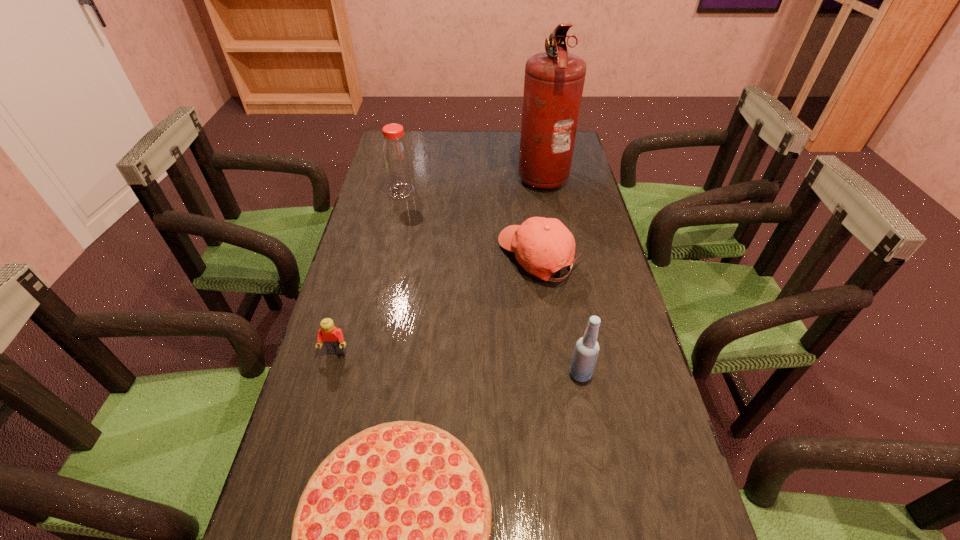
Find the location of a particular element. vacant space situated 0.330m at the front of the tallest object where the nozzle is aimed is located at coordinates (426, 175).

What are the coordinates of `free space located 0.140m at the front of the tallest object where the nozzle is aimed` in the screenshot? It's located at click(x=478, y=175).

Locate an element on the screen. This screenshot has height=540, width=960. vacant space located on the back of the farther bottle is located at coordinates (414, 137).

Where is `vacant space situated 0.330m on the back of the right bottle`? The height and width of the screenshot is (540, 960). vacant space situated 0.330m on the back of the right bottle is located at coordinates (560, 266).

You are a GUI agent. You are given a task and a screenshot of the screen. Output one action in this format:
    pyautogui.click(x=<x>, y=<y>)
    Task: Click on the vacant space located on the front of the third farthest object
    This screenshot has height=540, width=960.
    Given the screenshot: What is the action you would take?
    pos(559,408)

Locate an element on the screen. This screenshot has width=960, height=540. blank space located 0.090m on the face of the second shortest object is located at coordinates (324, 393).

Where is `object that is at the far edge`? This screenshot has height=540, width=960. object that is at the far edge is located at coordinates (554, 80).

What are the coordinates of `bottle positioned at the left edge` in the screenshot? It's located at (397, 162).

Locate an element on the screen. Lego that is at the left edge is located at coordinates (333, 339).

You are a GUI agent. You are given a task and a screenshot of the screen. Output one action in this format:
    pyautogui.click(x=<x>, y=<y>)
    Task: Click on the fire extinguisher located at the right edge
    The width and height of the screenshot is (960, 540).
    Given the screenshot: What is the action you would take?
    pos(554,80)